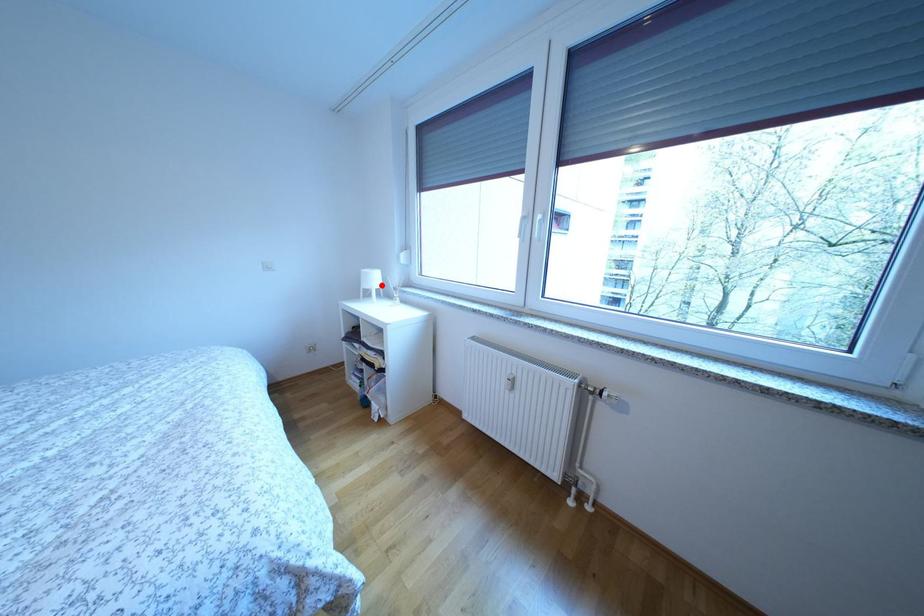
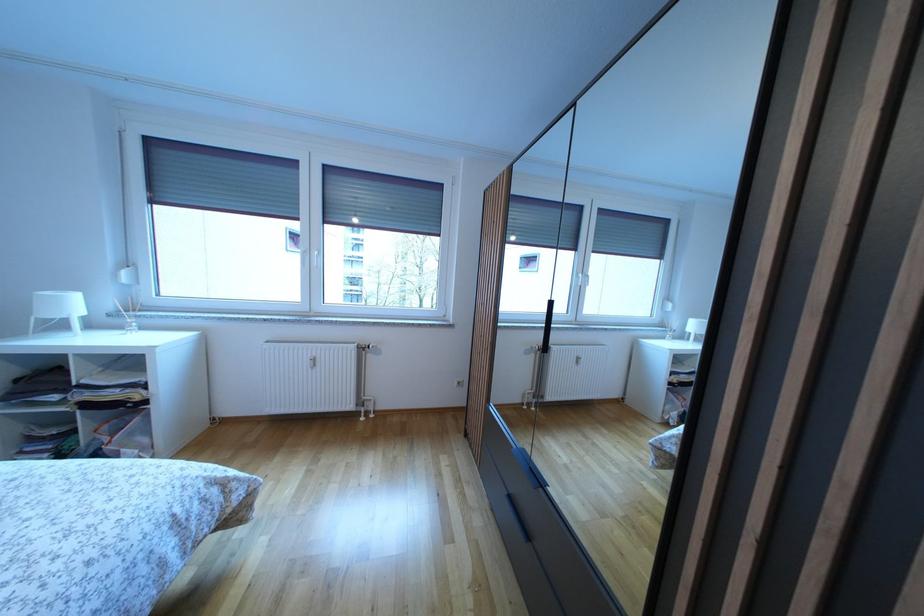
Find the pixel in the second image that matches the highlighted location in the first image.

(78, 310)